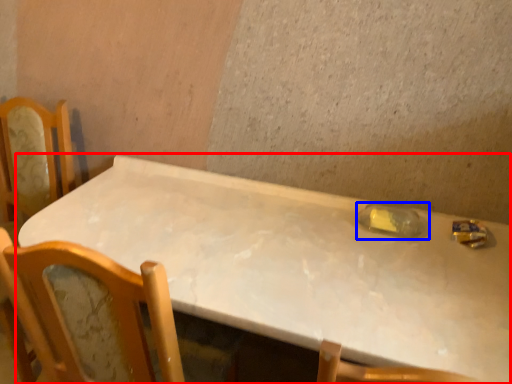
Question: Which object appears farthest to the camera in this image, table (highlighted by a red box) or bottle (highlighted by a blue box)?

Choices:
 (A) table
 (B) bottle

Answer: (B)